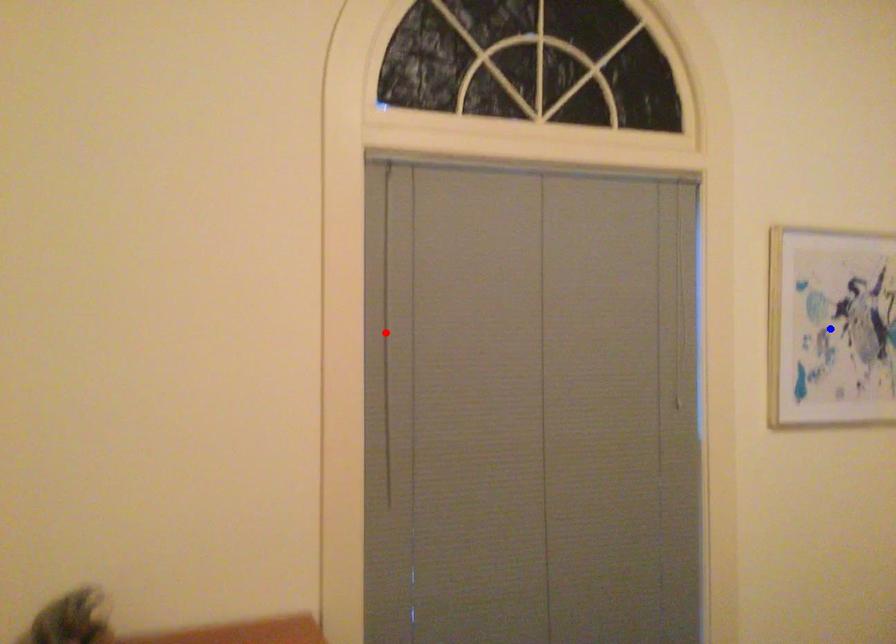
Question: Two points are marked on the image. Which point is closer to the camera?

Choices:
 (A) Blue point is closer.
 (B) Red point is closer.

Answer: (B)